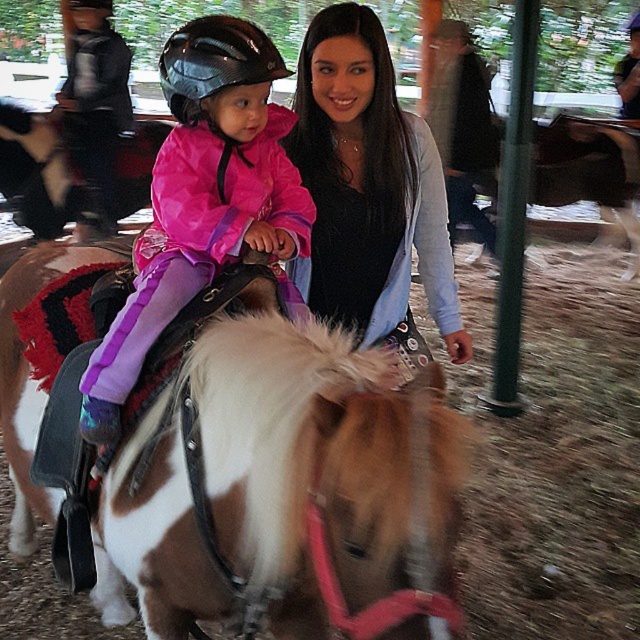
You are a photographer trying to capture a clear photo of both the pink matte jacket at upper left and the smooth black shirt at center. Since you want to ensure both are in focus, you need to know their heights. Which object is shorter?

The pink matte jacket at upper left is shorter than the smooth black shirt at center.

You are a safety inspector checking the positioning of the brushed metal helmet at upper left in the image. According to the safety guidelines, helmets must be placed within the designated safety zone marked between coordinates 0.1 to 0.2 on both axes. Is the helmet within the required safety zone?

The brushed metal helmet at upper left is located at point (97,102), which falls within the safety zone coordinates of 0.1 to 0.2 on both axes. Therefore, the helmet is properly positioned within the required safety zone.